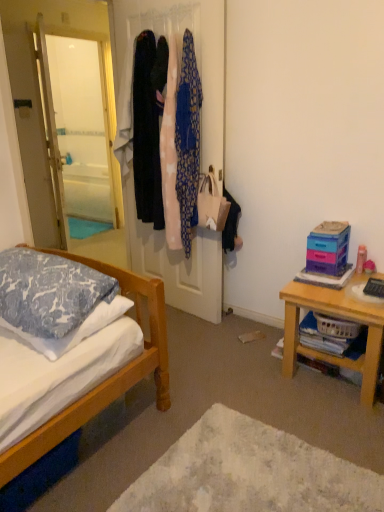
This screenshot has width=384, height=512. I want to click on silky fabric coats at center, so click(196, 53).

I want to click on wooden table at right, so 339,317.

Looking at this image, in order to face wooden table at right, should I rotate leftwards or rightwards?

A 19.022 degree turn to the right will do.

What is the approximate height of white soft rug at lower center?

The height of white soft rug at lower center is 1.52 inches.

Measure the distance between white soft rug at lower center and camera.

white soft rug at lower center and camera are 1.49 meters apart from each other.

Image resolution: width=384 pixels, height=512 pixels. Identify the location of white soft pillow at lower left, acting as the 1th pillow starting from the bottom. (75, 329).

What do you see at coordinates (148, 126) in the screenshot? I see `dark blue fabric dress at center, which is the first clothing from left to right` at bounding box center [148, 126].

At what (x,y) coordinates should I click in order to perform the action: click on dark blue fabric dress at center, positioned as the third clothing in right-to-left order. Please return your answer as a coordinate pair (x, y). This screenshot has width=384, height=512. Looking at the image, I should click on (148, 126).

The height and width of the screenshot is (512, 384). What are the coordinates of `pink fabric at center, arranged as the second clothing when viewed from the right` in the screenshot? It's located at (170, 148).

Image resolution: width=384 pixels, height=512 pixels. In order to click on closet located above the white soft pillow at lower left, the second pillow from the top (from a real-world perspective) in this screenshot , I will do `click(196, 53)`.

From the image's perspective, which one is positioned higher, silky fabric coats at center or white soft pillow at lower left, the second pillow from the top?

From the image's view, silky fabric coats at center is above.

Considering the sizes of objects silky fabric coats at center and white soft pillow at lower left, acting as the 1th pillow starting from the bottom, in the image provided, who is smaller, silky fabric coats at center or white soft pillow at lower left, acting as the 1th pillow starting from the bottom,?

Smaller between the two is white soft pillow at lower left, acting as the 1th pillow starting from the bottom.

Is white soft rug at lower center inside or outside of wooden table at right?

white soft rug at lower center cannot be found inside wooden table at right.

Measure the distance from white soft rug at lower center to wooden table at right.

white soft rug at lower center is 24.79 inches away from wooden table at right.

Is white soft rug at lower center not near wooden table at right?

They are positioned close to each other.

Considering the relative sizes of white soft rug at lower center and wooden table at right in the image provided, is white soft rug at lower center smaller than wooden table at right?

Yes.

Could you measure the distance between dark blue fabric dress at center, positioned as the third clothing in right-to-left order, and silky fabric coats at center?

A distance of 19.22 inches exists between dark blue fabric dress at center, positioned as the third clothing in right-to-left order, and silky fabric coats at center.

From the image's perspective, which is below, dark blue fabric dress at center, which is the first clothing from left to right, or silky fabric coats at center?

From the image's view, silky fabric coats at center is below.

Between point (143, 88) and point (154, 237), which one is positioned behind?

The point (154, 237) is behind.

Would you say dark blue fabric dress at center, which is the first clothing from left to right, is to the left or to the right of silky fabric coats at center in the picture?

Based on their positions, dark blue fabric dress at center, which is the first clothing from left to right, is located to the left of silky fabric coats at center.

Is white soft pillow at lower left, acting as the 1th pillow starting from the bottom, positioned far away from pink fabric at center, arranged as the second clothing when viewed from the right?

Yes.

Is white soft pillow at lower left, the second pillow from the top, thinner than pink fabric at center, arranged as the second clothing when viewed from the right?

Incorrect, the width of white soft pillow at lower left, the second pillow from the top, is not less than that of pink fabric at center, arranged as the second clothing when viewed from the right.

From a real-world perspective, which is physically below, white soft pillow at lower left, acting as the 1th pillow starting from the bottom, or pink fabric at center, arranged as the second clothing when viewed from the right?

white soft pillow at lower left, acting as the 1th pillow starting from the bottom.

How much distance is there between white soft pillow at lower left, acting as the 1th pillow starting from the bottom, and pink fabric at center, positioned as the second clothing in left-to-right order?

white soft pillow at lower left, acting as the 1th pillow starting from the bottom, and pink fabric at center, positioned as the second clothing in left-to-right order, are 3.64 feet apart from each other.

Locate an element on the screen. The image size is (384, 512). desk in front of the silky fabric coats at center is located at coordinates (339, 317).

Does wooden table at right appear on the right side of silky fabric coats at center?

Indeed, wooden table at right is positioned on the right side of silky fabric coats at center.

Is point (367, 306) closer to camera compared to point (198, 236)?

That is True.

From the picture: Based on their sizes in the image, would you say wooden table at right is bigger or smaller than silky fabric coats at center?

wooden table at right is smaller than silky fabric coats at center.

From a real-world perspective, who is located lower, dark blue fabric dress at center, positioned as the third clothing in right-to-left order, or white soft pillow at lower left, the second pillow from the top?

white soft pillow at lower left, the second pillow from the top.

Between dark blue fabric dress at center, positioned as the third clothing in right-to-left order, and white soft pillow at lower left, acting as the 1th pillow starting from the bottom, which one has more height?

dark blue fabric dress at center, positioned as the third clothing in right-to-left order, is taller.

From a real-world perspective, which clothing is the 3rd one above the white soft pillow at lower left, the second pillow from the top? Please provide its 2D coordinates.

[(148, 126)]

Can you tell me how much dark blue fabric dress at center, which is the first clothing from left to right, and white soft pillow at lower left, acting as the 1th pillow starting from the bottom, differ in facing direction?

4.58 degrees separate the facing orientations of dark blue fabric dress at center, which is the first clothing from left to right, and white soft pillow at lower left, acting as the 1th pillow starting from the bottom.

How different are the orientations of white soft pillow at lower left, the second pillow from the top, and blue patterned pillow at left, placed as the first pillow when sorted from top to bottom, in degrees?

The angular difference between white soft pillow at lower left, the second pillow from the top, and blue patterned pillow at left, placed as the first pillow when sorted from top to bottom, is 2.62 degrees.

Is white soft pillow at lower left, the second pillow from the top, touching blue patterned pillow at left, the 2th pillow when ordered from bottom to top?

No, white soft pillow at lower left, the second pillow from the top, is not touching blue patterned pillow at left, the 2th pillow when ordered from bottom to top.

Can you confirm if white soft pillow at lower left, the second pillow from the top, is positioned to the right of blue patterned pillow at left, placed as the first pillow when sorted from top to bottom?

Yes.

From the image's perspective, is white soft pillow at lower left, acting as the 1th pillow starting from the bottom, positioned above or below blue patterned pillow at left, the 2th pillow when ordered from bottom to top?

Clearly, from the image's perspective, white soft pillow at lower left, acting as the 1th pillow starting from the bottom, is below blue patterned pillow at left, the 2th pillow when ordered from bottom to top.

Locate an element on the screen. closet above the white soft pillow at lower left, acting as the 1th pillow starting from the bottom (from the image's perspective) is located at coordinates (196, 53).

The image size is (384, 512). In order to click on plain located in front of the wooden table at right in this screenshot , I will do `click(249, 473)`.

When comparing their distances from dark blue fabric dress at center, which is the first clothing from left to right, does white soft rug at lower center or white soft pillow at lower left, the second pillow from the top, seem closer?

white soft pillow at lower left, the second pillow from the top, lies closer to dark blue fabric dress at center, which is the first clothing from left to right, than the other object.

Which object lies nearer to the anchor point white soft rug at lower center, wooden table at right or white soft pillow at lower left, the second pillow from the top?

wooden table at right is closer to white soft rug at lower center.

Considering their positions, is pink fabric at center, which is the third clothing from left to right, positioned further to pink fabric at center, positioned as the second clothing in left-to-right order, than dark blue fabric dress at center, which is the first clothing from left to right?

dark blue fabric dress at center, which is the first clothing from left to right, is further to pink fabric at center, positioned as the second clothing in left-to-right order.

Which object lies further to the anchor point pink fabric at center, the first clothing in the right-to-left sequence, wooden table at right or blue patterned pillow at left, placed as the first pillow when sorted from top to bottom?

The object further to pink fabric at center, the first clothing in the right-to-left sequence, is blue patterned pillow at left, placed as the first pillow when sorted from top to bottom.

Looking at the image, which one is located closer to white soft rug at lower center, pink fabric at center, which is the third clothing from left to right, or dark blue fabric dress at center, which is the first clothing from left to right?

pink fabric at center, which is the third clothing from left to right, is positioned closer to the anchor white soft rug at lower center.

Estimate the real-world distances between objects in this image. Which object is further from white soft pillow at lower left, the second pillow from the top, white soft rug at lower center or blue patterned pillow at left, the 2th pillow when ordered from bottom to top?

white soft rug at lower center.

Which object lies further to the anchor point blue patterned pillow at left, placed as the first pillow when sorted from top to bottom, wooden table at right or white soft rug at lower center?

The object further to blue patterned pillow at left, placed as the first pillow when sorted from top to bottom, is wooden table at right.

Estimate the real-world distances between objects in this image. Which object is further from wooden table at right, white soft pillow at lower left, the second pillow from the top, or blue patterned pillow at left, placed as the first pillow when sorted from top to bottom?

blue patterned pillow at left, placed as the first pillow when sorted from top to bottom.

This screenshot has width=384, height=512. I want to click on closet that lies between dark blue fabric dress at center, positioned as the third clothing in right-to-left order, and white soft pillow at lower left, the second pillow from the top, from top to bottom, so click(x=196, y=53).

In order to click on clothing that lies between pink fabric at center, arranged as the second clothing when viewed from the right, and blue patterned pillow at left, the 2th pillow when ordered from bottom to top, from top to bottom in this screenshot , I will do `click(188, 140)`.

This screenshot has width=384, height=512. In order to click on clothing located between dark blue fabric dress at center, which is the first clothing from left to right, and pink fabric at center, which is the third clothing from left to right, in the left-right direction in this screenshot , I will do `click(170, 148)`.

This screenshot has height=512, width=384. Find the location of `desk between silky fabric coats at center and white soft rug at lower center in the vertical direction`. desk between silky fabric coats at center and white soft rug at lower center in the vertical direction is located at coordinates (339, 317).